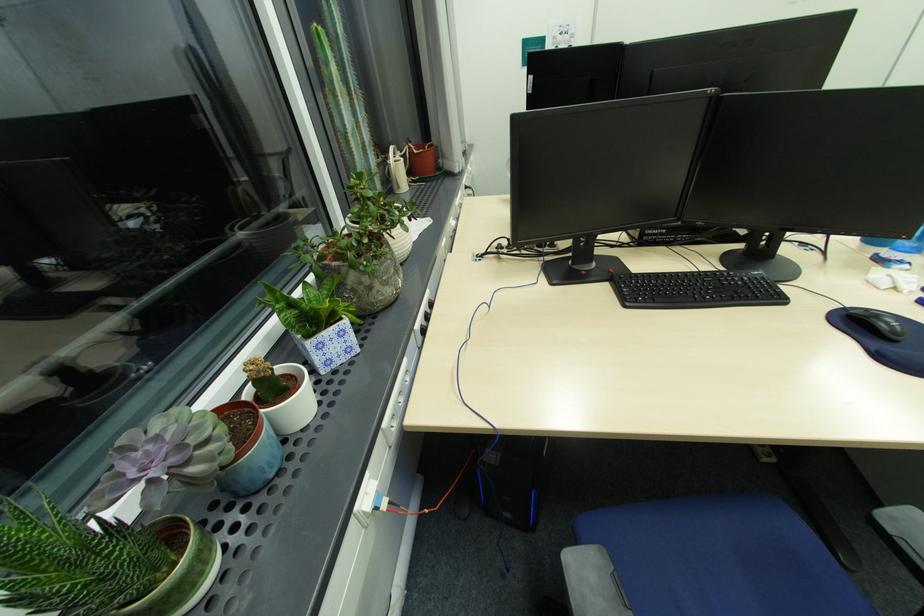
The height and width of the screenshot is (616, 924). Find the location of `blue chair sitting surface`. blue chair sitting surface is located at coordinates (736, 562).